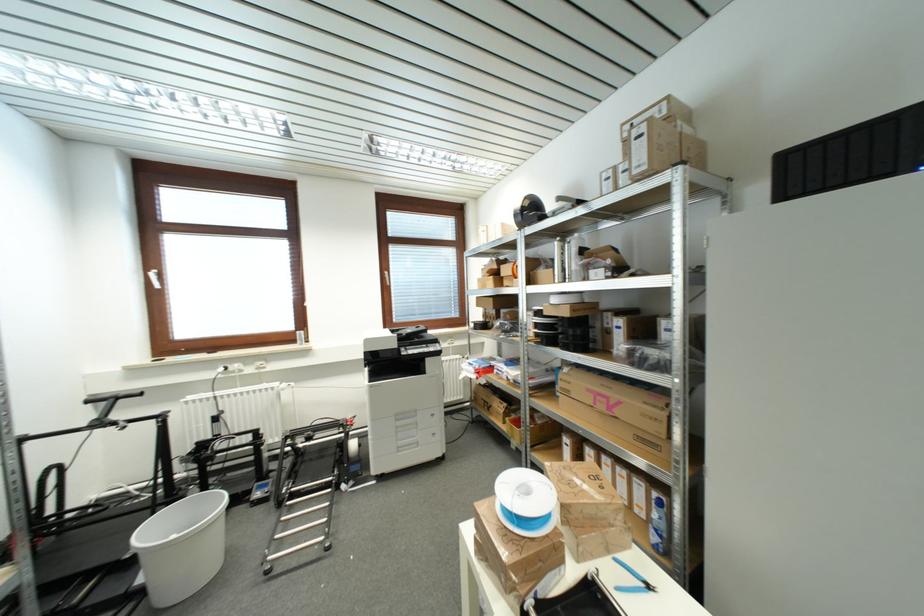
Locate an element on the screen. This screenshot has height=616, width=924. blue handle pliers is located at coordinates (633, 580).